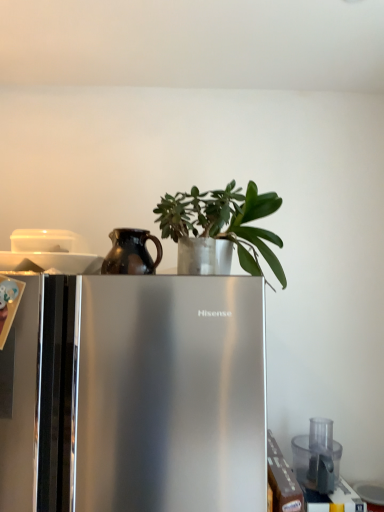
Question: Considering the relative positions of green matte plant at center and transparent plastic food processor at lower right in the image provided, is green matte plant at center behind transparent plastic food processor at lower right?

Choices:
 (A) yes
 (B) no

Answer: (B)

Question: Is transparent plastic food processor at lower right completely or partially inside green matte plant at center?

Choices:
 (A) no
 (B) yes

Answer: (A)

Question: Is green matte plant at center beside transparent plastic food processor at lower right?

Choices:
 (A) yes
 (B) no

Answer: (B)

Question: Considering the relative positions of green matte plant at center and transparent plastic food processor at lower right in the image provided, is green matte plant at center to the left of transparent plastic food processor at lower right from the viewer's perspective?

Choices:
 (A) no
 (B) yes

Answer: (B)

Question: Does green matte plant at center have a larger size compared to transparent plastic food processor at lower right?

Choices:
 (A) yes
 (B) no

Answer: (A)

Question: Considering the relative sizes of green matte plant at center and transparent plastic food processor at lower right in the image provided, is green matte plant at center taller than transparent plastic food processor at lower right?

Choices:
 (A) yes
 (B) no

Answer: (A)

Question: From the image's perspective, is transparent plastic food processor at lower right on top of satin silver refrigerator at center?

Choices:
 (A) yes
 (B) no

Answer: (B)

Question: Are transparent plastic food processor at lower right and satin silver refrigerator at center beside each other?

Choices:
 (A) no
 (B) yes

Answer: (A)

Question: Does transparent plastic food processor at lower right appear on the right side of satin silver refrigerator at center?

Choices:
 (A) no
 (B) yes

Answer: (B)

Question: Is transparent plastic food processor at lower right positioned with its back to satin silver refrigerator at center?

Choices:
 (A) yes
 (B) no

Answer: (B)

Question: Is transparent plastic food processor at lower right positioned behind satin silver refrigerator at center?

Choices:
 (A) yes
 (B) no

Answer: (A)

Question: Is transparent plastic food processor at lower right positioned far away from satin silver refrigerator at center?

Choices:
 (A) yes
 (B) no

Answer: (B)

Question: Can you confirm if transparent plastic food processor at lower right is shorter than green matte plant at center?

Choices:
 (A) no
 (B) yes

Answer: (B)